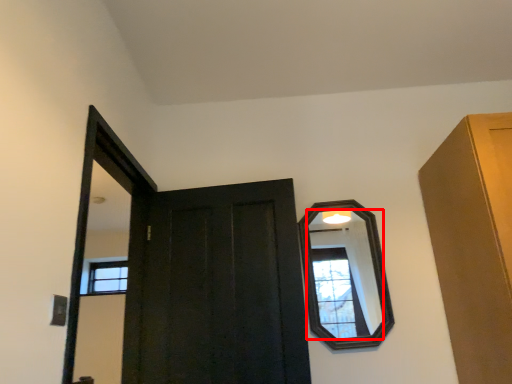
Question: In this image, where is mirror (annotated by the red box) located relative to door?

Choices:
 (A) left
 (B) right

Answer: (B)